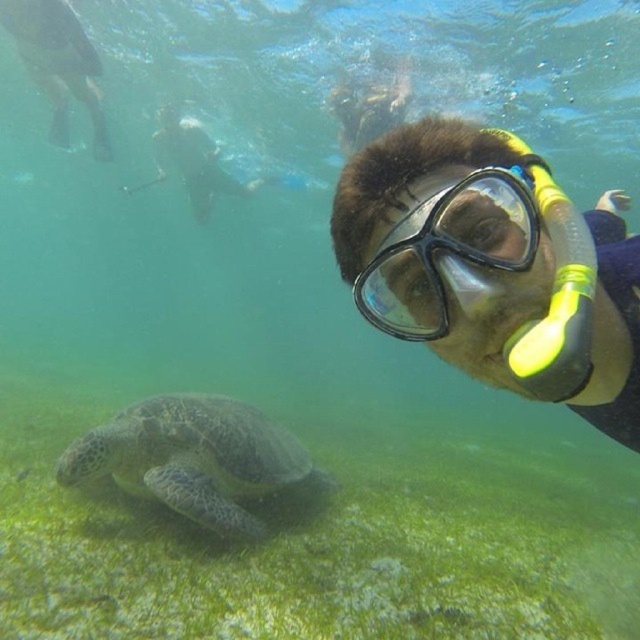
Question: Does clear plastic mask at center have a greater width compared to black matte scuba mask at upper right?

Choices:
 (A) yes
 (B) no

Answer: (A)

Question: Considering the real-world distances, which object is closest to the green matte turtle at lower left?

Choices:
 (A) black matte scuba mask at upper right
 (B) clear plastic mask at center

Answer: (B)

Question: Which is nearer to the black matte scuba mask at upper right?

Choices:
 (A) clear plastic mask at center
 (B) green matte turtle at lower left

Answer: (A)

Question: Does clear plastic mask at center appear under black matte scuba mask at upper right?

Choices:
 (A) no
 (B) yes

Answer: (B)

Question: Is clear plastic mask at center above black matte scuba mask at upper right?

Choices:
 (A) yes
 (B) no

Answer: (B)

Question: Which object appears closest to the camera in this image?

Choices:
 (A) clear plastic mask at center
 (B) black matte scuba mask at upper right
 (C) green matte turtle at lower left

Answer: (A)